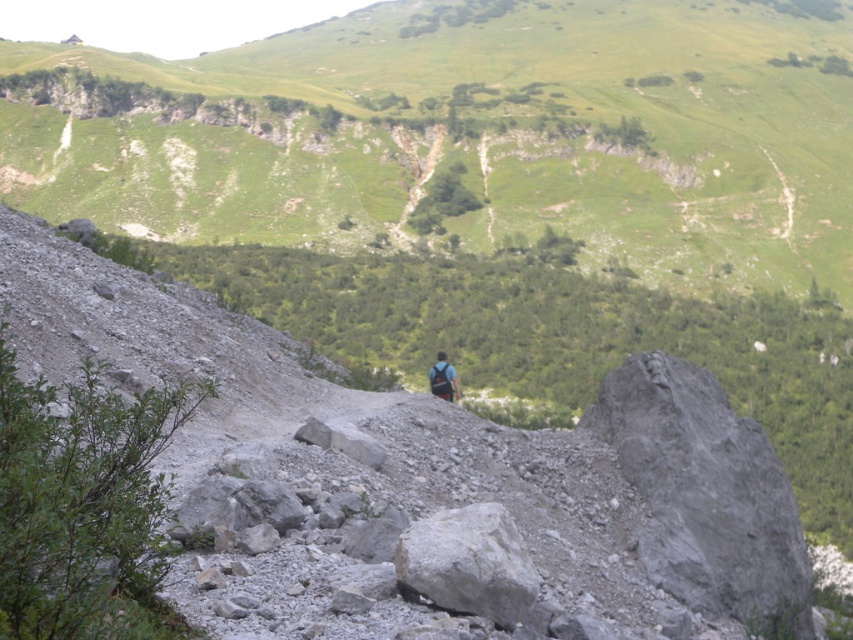
Question: Does gray rough rock at center have a lesser width compared to dark blue backpack at center?

Choices:
 (A) no
 (B) yes

Answer: (A)

Question: Can you confirm if gray rough rock at center is positioned above dark blue backpack at center?

Choices:
 (A) no
 (B) yes

Answer: (A)

Question: Does gray rough rock at center appear under dark blue backpack at center?

Choices:
 (A) yes
 (B) no

Answer: (A)

Question: Among these points, which one is farthest from the camera?

Choices:
 (A) (453, 376)
 (B) (412, 547)

Answer: (A)